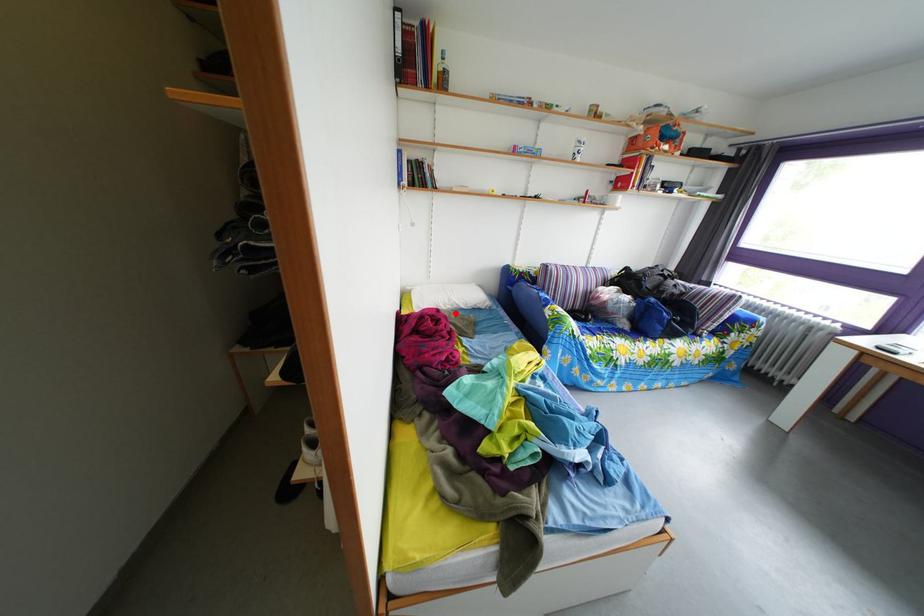
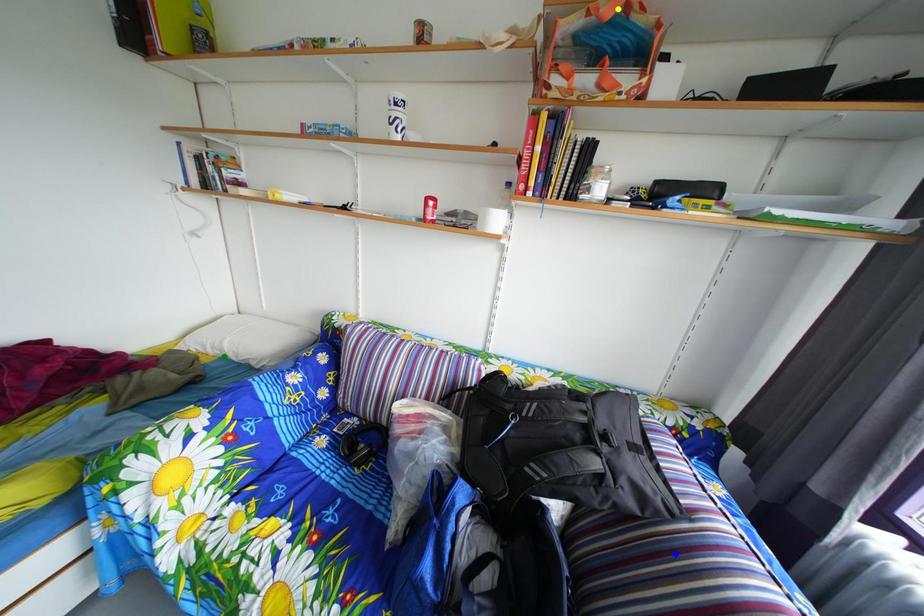
Question: I am providing you with two images of the same scene from different viewpoints. A red point is marked on the first image. You are given multiple points on the second image. Which point in image 2 is actually the same real-world point as the red point in image 1?

Choices:
 (A) yellow point
 (B) blue point
 (C) green point

Answer: (C)